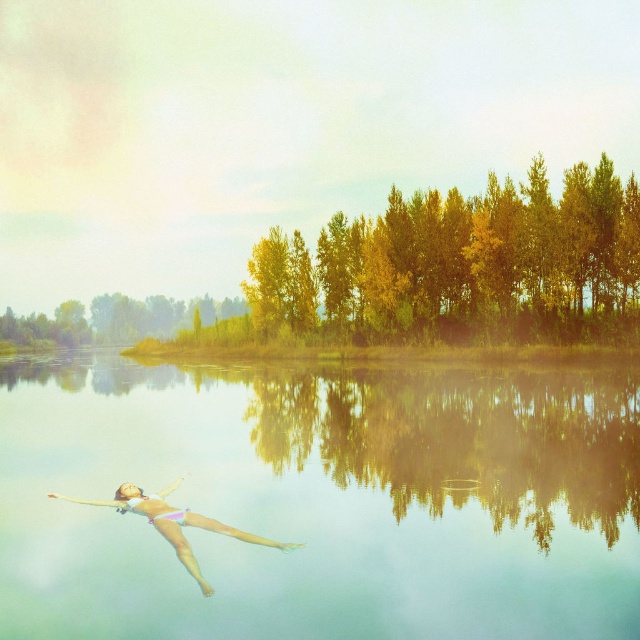
Between green leafy trees at center and pink fabric bikini at lower left, which one is positioned higher?

green leafy trees at center is above.

Who is taller, green leafy trees at center or pink fabric bikini at lower left?

green leafy trees at center

Does point (124, 300) come farther from viewer compared to point (148, 516)?

That is True.

Locate an element on the screen. green leafy trees at center is located at coordinates (113, 321).

Is clear water at center smaller than pink fabric bikini at lower left?

No, clear water at center is not smaller than pink fabric bikini at lower left.

Who is more distant from viewer, (417, 387) or (120, 499)?

The point (417, 387) is behind.

Between point (298, 388) and point (138, 490), which one is positioned behind?

Point (298, 388)

In order to click on clear water at center in this screenshot , I will do `click(323, 500)`.

Which is below, golden textured trees at upper right or pink fabric bikini at lower left?

pink fabric bikini at lower left is below.

Does golden textured trees at upper right lie in front of pink fabric bikini at lower left?

No, golden textured trees at upper right is further to the viewer.

The width and height of the screenshot is (640, 640). Find the location of `golden textured trees at upper right`. golden textured trees at upper right is located at coordinates (460, 257).